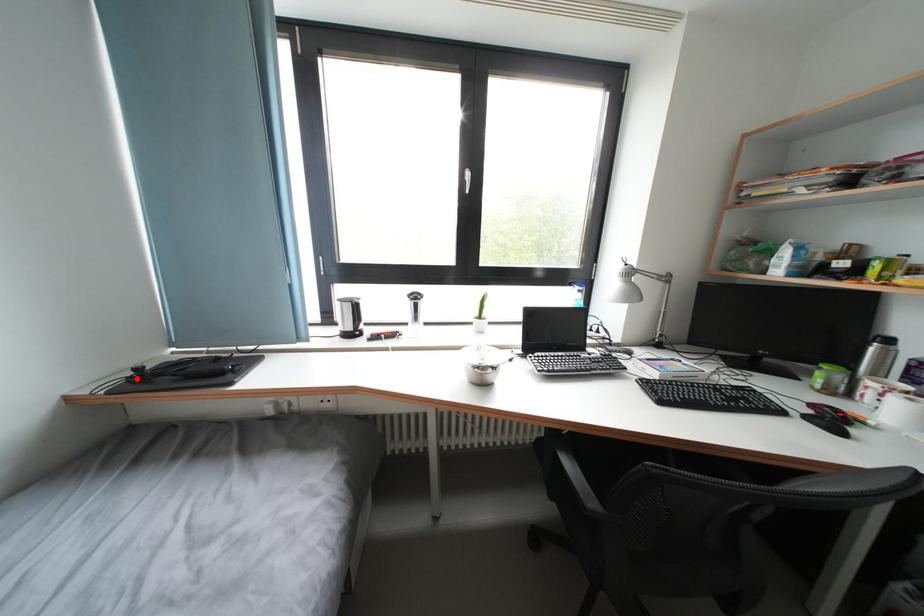
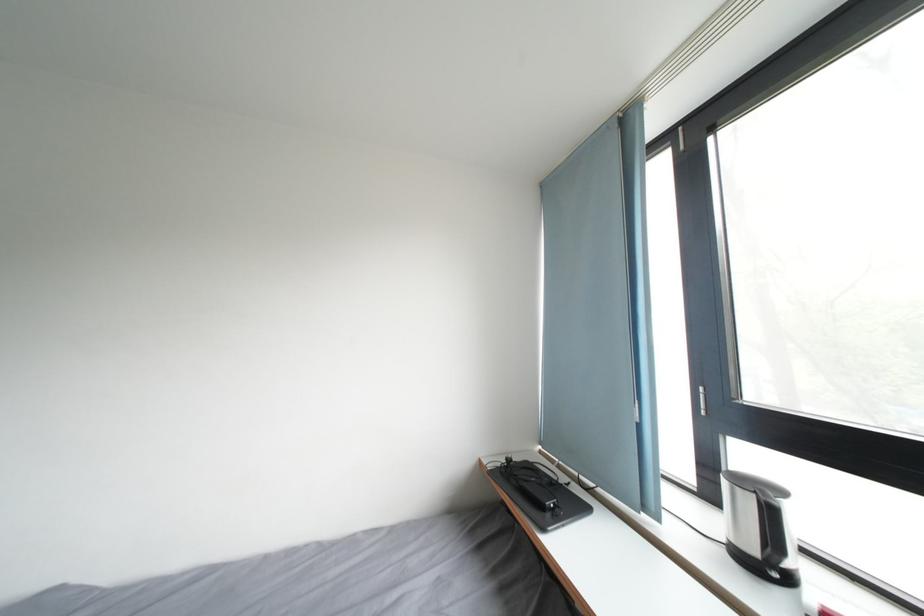
Find the pixel in the second image that matches the highlighted location in the first image.

(512, 467)